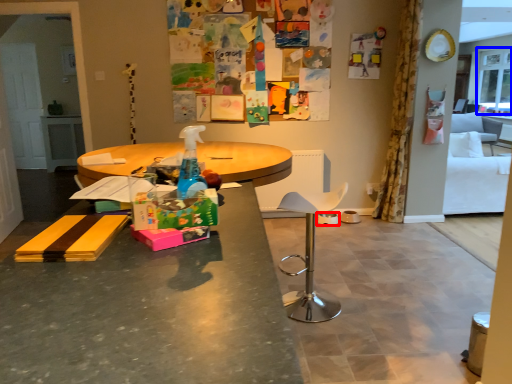
Question: Among these objects, which one is farthest to the camera, bowl (highlighted by a red box) or window screen (highlighted by a blue box)?

Choices:
 (A) bowl
 (B) window screen

Answer: (B)